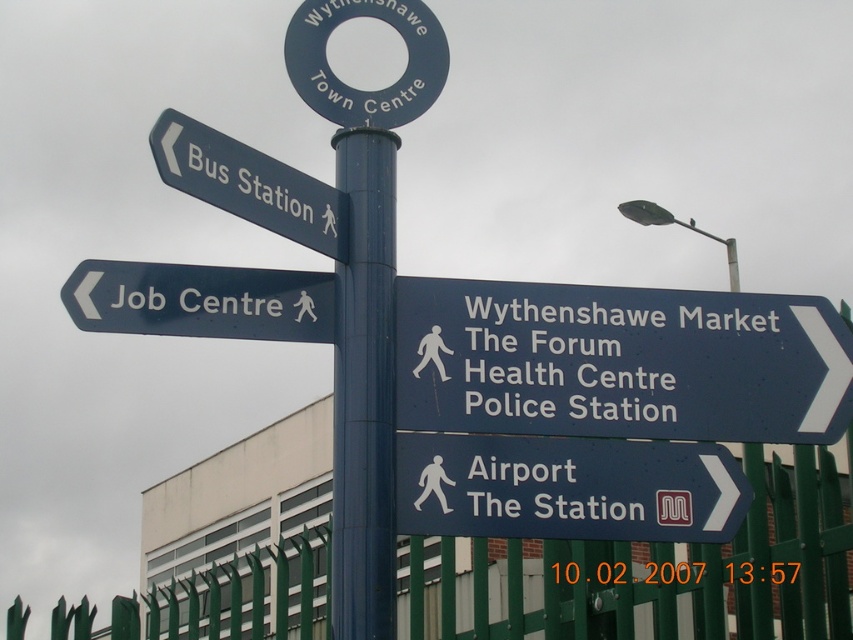
You are standing in front of the signpost described. There is a blue plastic sign at lower center. Where exactly is this sign positioned relative to the other signs on the pole?

The blue plastic sign at lower center is located at point coordinates 0.764 on the x axis and 0.666 on the y axis.

You are a delivery driver who needs to park your vehicle near the green metal fence at lower right and the matte black sign at left. Which object will block your view more if you park behind it?

The green metal fence at lower right has a greater height compared to matte black sign at left, so parking behind it will block your view more than the matte black sign at left.

You are a pedestrian standing at the street signpost and need to determine the relative sizes of the objects. Which object is larger when comparing the blue metallic sign at center right and the green metal fence at lower right?

The green metal fence at lower right is larger than the blue metallic sign at center right.